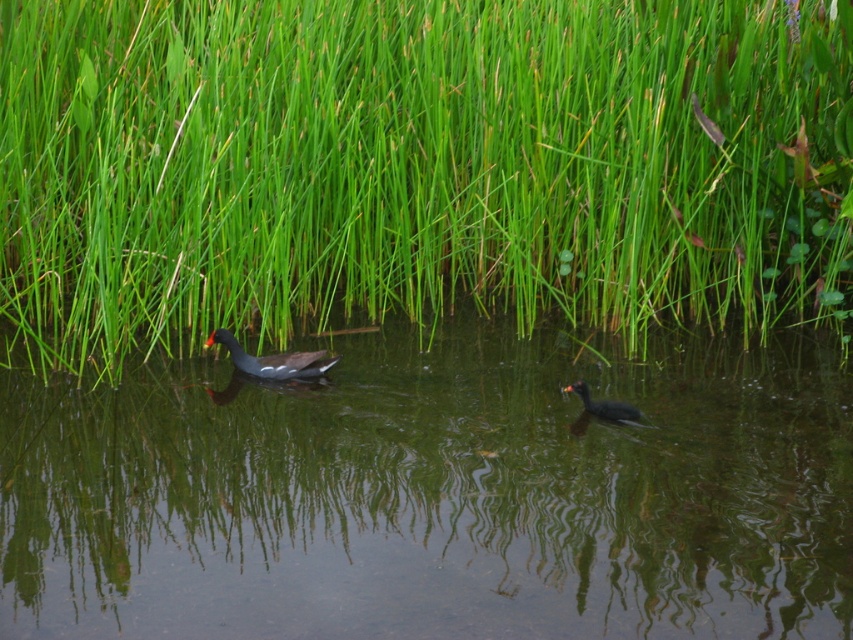
Question: Is green grass at center to the right of dark gray matte duck at center from the viewer's perspective?

Choices:
 (A) yes
 (B) no

Answer: (A)

Question: Which object is closer to the camera taking this photo?

Choices:
 (A) dark gray matte duck at center
 (B) clear water at center
 (C) dark gray matte duck at lower right

Answer: (B)

Question: Which point appears farthest from the camera in this image?

Choices:
 (A) (103, 125)
 (B) (258, 358)

Answer: (A)

Question: Is clear water at center smaller than dark gray matte duck at center?

Choices:
 (A) no
 (B) yes

Answer: (A)

Question: Which point is closer to the camera?

Choices:
 (A) (306, 364)
 (B) (422, 289)

Answer: (A)

Question: Does dark gray matte duck at center come in front of dark gray matte duck at lower right?

Choices:
 (A) yes
 (B) no

Answer: (B)